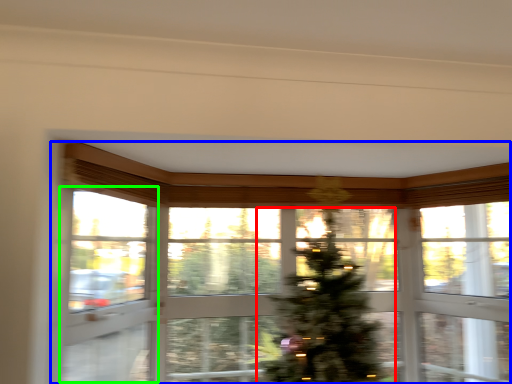
Question: Which object is positioned farthest from christmas tree (highlighted by a red box)? Select from window (highlighted by a blue box) and screen door (highlighted by a green box).

Choices:
 (A) window
 (B) screen door

Answer: (B)